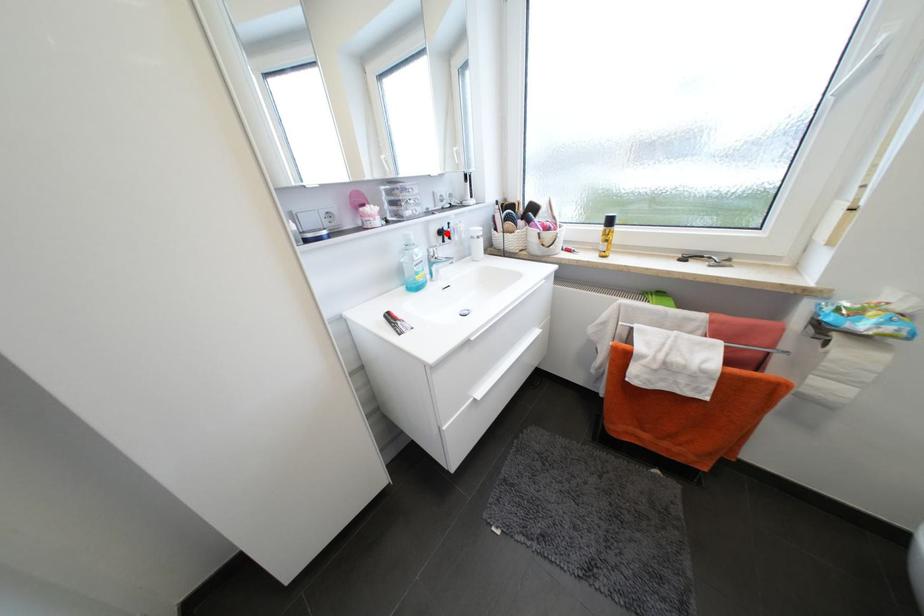
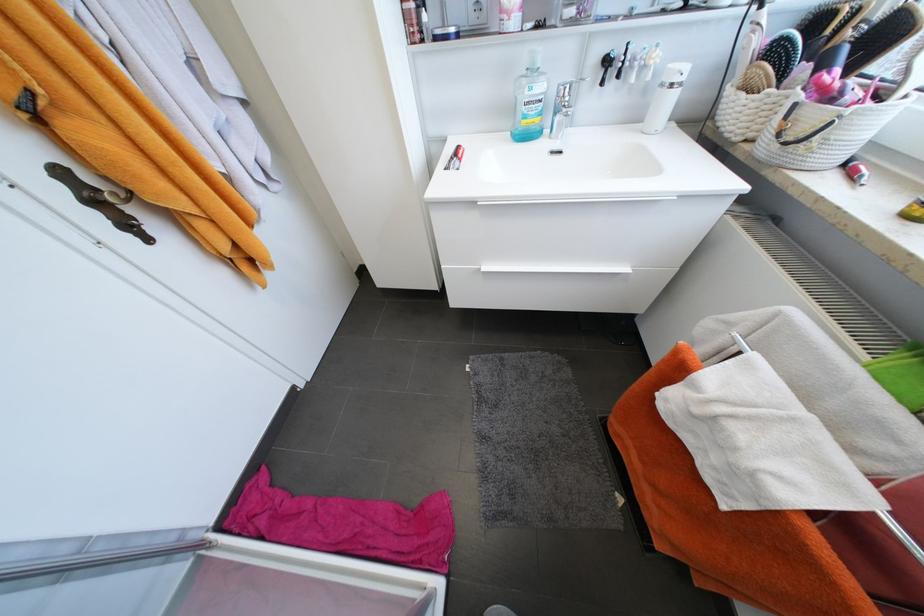
Locate, in the second image, the point that corresponds to the highlighted location in the first image.

(613, 62)